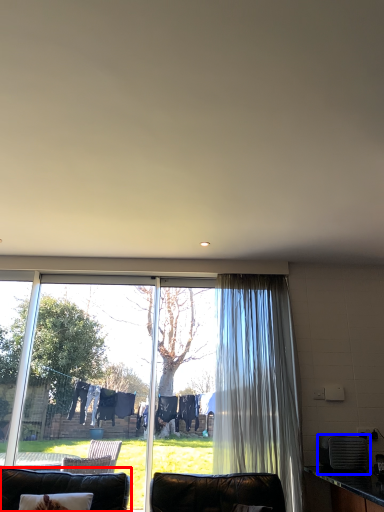
Question: Which object is further to the camera taking this photo, furniture (highlighted by a red box) or appliance (highlighted by a blue box)?

Choices:
 (A) furniture
 (B) appliance

Answer: (B)